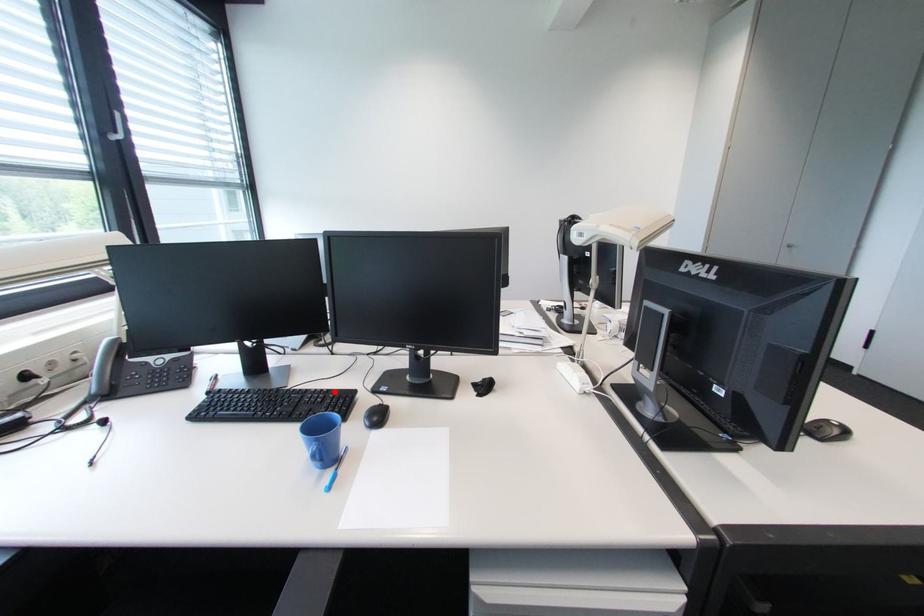
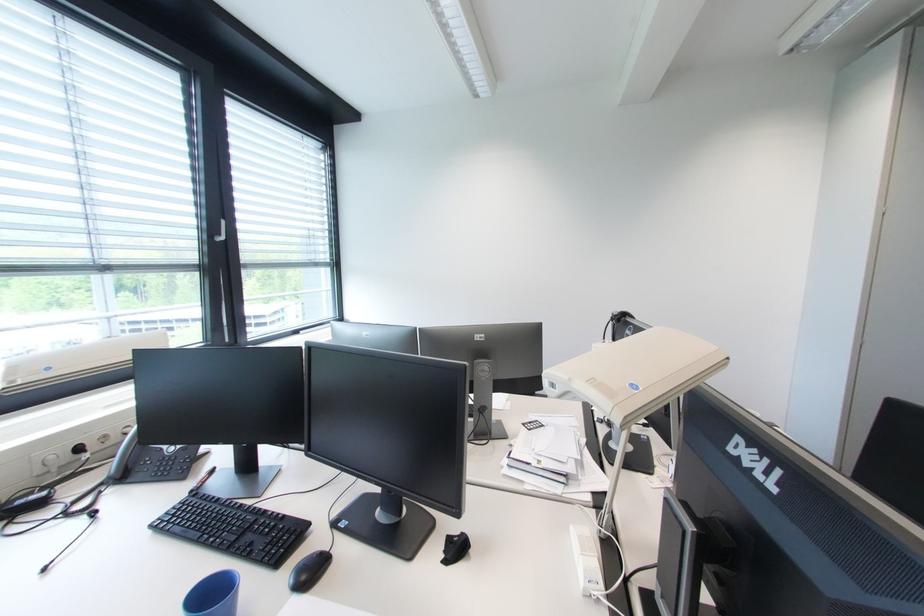
Find the pixel in the second image that matches the highlighted location in the first image.

(290, 517)